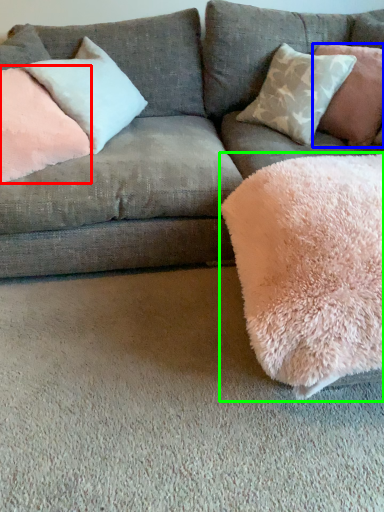
Question: Considering the real-world distances, which object is closest to pillow (highlighted by a red box)? pillow (highlighted by a blue box) or blanket (highlighted by a green box).

Choices:
 (A) pillow
 (B) blanket

Answer: (B)